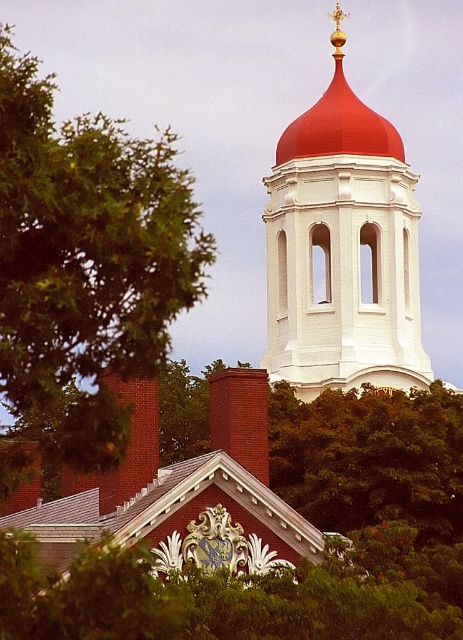
You are an architect assessing the height of two structures in the image. The white smooth tower at upper center and the brick chimney at center. Which one is taller?

The white smooth tower at upper center is taller than the brick chimney at center according to the description.

Based on the photo, you are standing at the center of the image. Which direction should you face to see the green leafy tree at left?

The green leafy tree at left is located at point (83, 269), which is to the left side of the image. Therefore, you should face to the left to see the green leafy tree at left.

You are standing in a courtyard and see the green leafy tree at left and the matte brick church at center. Which object is closer to you?

The green leafy tree at left is closer to you because it is in front of the matte brick church at center.